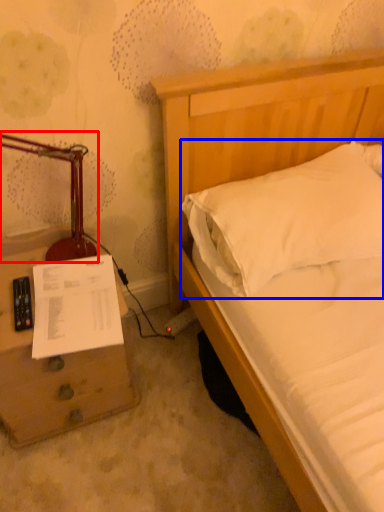
Question: Which object appears closest to the camera in this image, table lamp (highlighted by a red box) or pillow (highlighted by a blue box)?

Choices:
 (A) table lamp
 (B) pillow

Answer: (A)